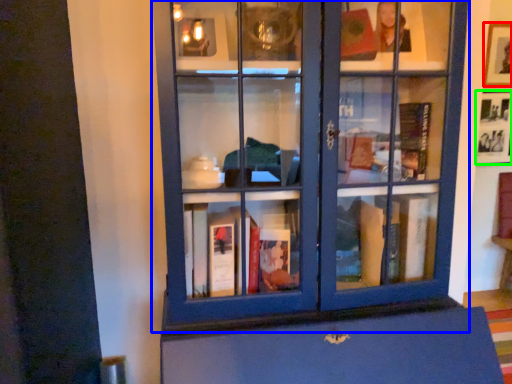
Question: Considering the real-world distances, which object is farthest from picture frame (highlighted by a red box)? bookcase (highlighted by a blue box) or picture frame (highlighted by a green box)?

Choices:
 (A) bookcase
 (B) picture frame

Answer: (A)